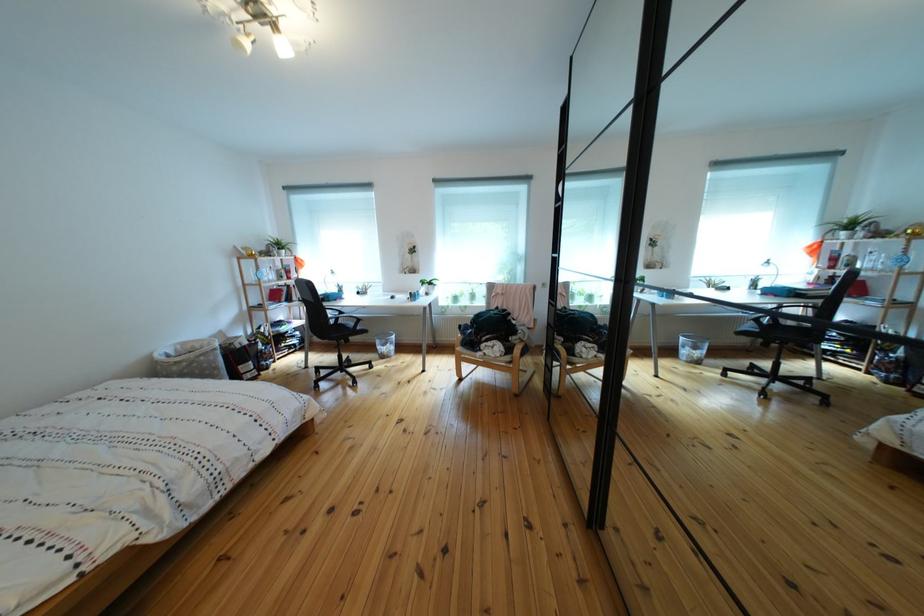
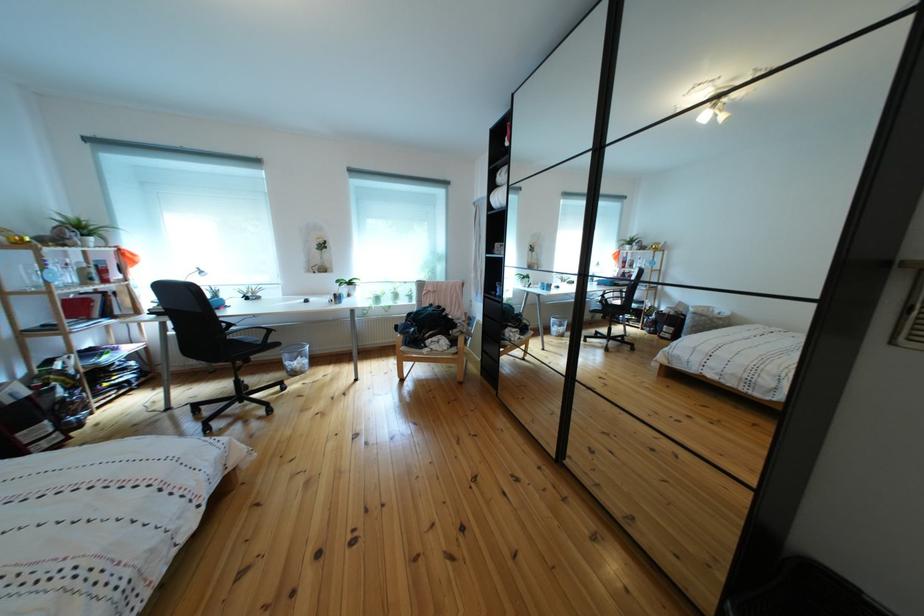
Question: Which direction would the cameraman need to move to produce the second image? Reply with the corresponding letter.

Choices:
 (A) Left
 (B) Right
 (C) Forward
 (D) Backward

Answer: (A)